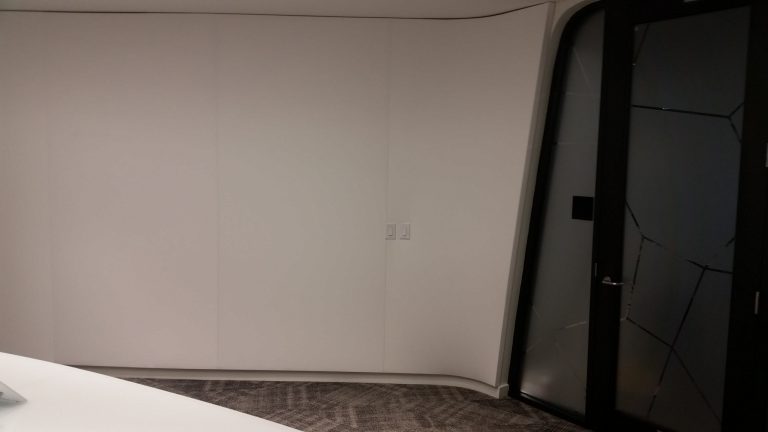
Locate an element on the screen. The image size is (768, 432). door is located at coordinates 617,230.